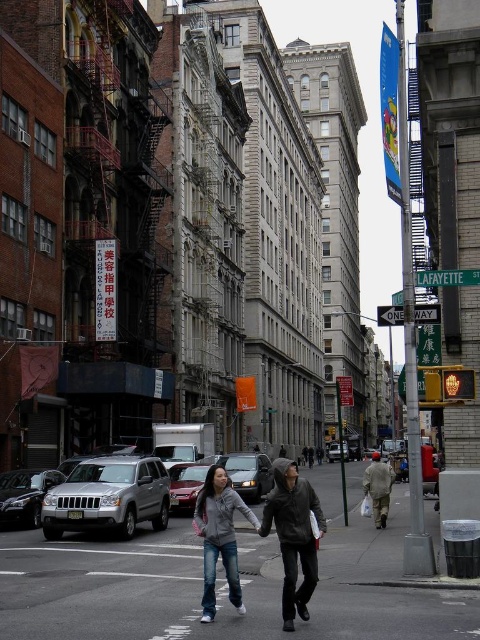
You are a pedestrian standing at the edge of the street. You see a silver metallic sedan at center and a gray hoodie at center. Which object is closer to you?

The silver metallic sedan at center is closer to you because it is further to the viewer than the gray hoodie at center.